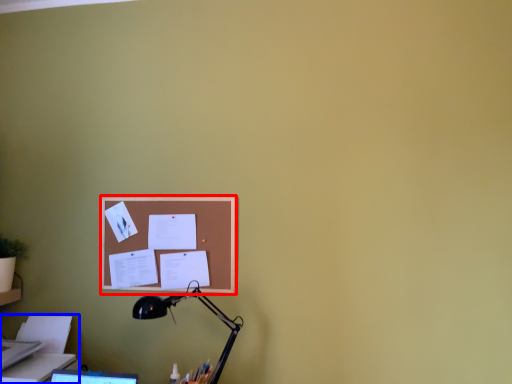
Question: Which point is closer to the camera, bulletin board (highlighted by a red box) or printer (highlighted by a blue box)?

Choices:
 (A) bulletin board
 (B) printer

Answer: (B)